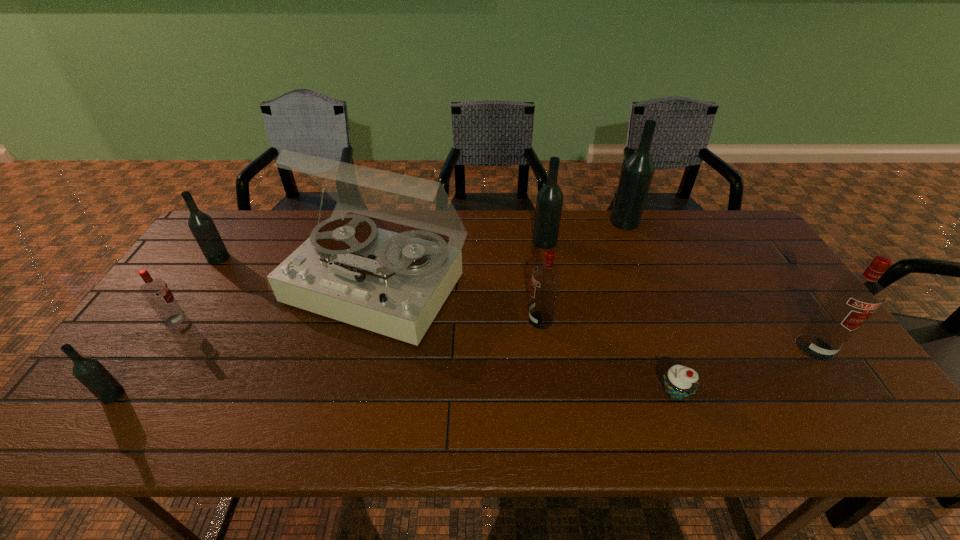
Locate which object is the fourth closest to the second nearest black vodka. Please provide its 2D coordinates. Your answer should be formatted as a tuple, i.e. [(x, y)], where the tuple contains the x and y coordinates of a point satisfying the conditions above.

[(546, 278)]

Locate which object is the sixth closest to the farthest object. Please provide its 2D coordinates. Your answer should be formatted as a tuple, i.e. [(x, y)], where the tuple contains the x and y coordinates of a point satisfying the conditions above.

[(201, 225)]

Select which vodka appears as the fourth closest to the smallest black vodka. Please provide its 2D coordinates. Your answer should be formatted as a tuple, i.e. [(x, y)], where the tuple contains the x and y coordinates of a point satisfying the conditions above.

[(549, 202)]

This screenshot has width=960, height=540. In order to click on vodka that stands as the fifth closest to the third black vodka from left to right in this screenshot , I will do `click(157, 293)`.

Identify which black vodka is the third closest to the leftmost red vodka. Please provide its 2D coordinates. Your answer should be formatted as a tuple, i.e. [(x, y)], where the tuple contains the x and y coordinates of a point satisfying the conditions above.

[(549, 202)]

You are a GUI agent. You are given a task and a screenshot of the screen. Output one action in this format:
    pyautogui.click(x=<x>, y=<y>)
    Task: Click on the black vodka that is the closest to the smallest black vodka
    Image resolution: width=960 pixels, height=540 pixels.
    Given the screenshot: What is the action you would take?
    pyautogui.click(x=201, y=225)

Point out which red vodka is positioned as the second nearest to the second nearest black vodka. Please provide its 2D coordinates. Your answer should be formatted as a tuple, i.e. [(x, y)], where the tuple contains the x and y coordinates of a point satisfying the conditions above.

[(546, 278)]

Where is `red vodka object that ranks as the closest to the second farthest black vodka`? red vodka object that ranks as the closest to the second farthest black vodka is located at coordinates (546, 278).

This screenshot has height=540, width=960. Find the location of `free region that satisfies the following two spatial constraints: 1. on the back side of the sixth vodka from left to right; 2. on the left side of the shortest object`. free region that satisfies the following two spatial constraints: 1. on the back side of the sixth vodka from left to right; 2. on the left side of the shortest object is located at coordinates (612, 222).

Locate an element on the screen. blank area in the image that satisfies the following two spatial constraints: 1. on the back side of the second nearest black vodka; 2. on the left side of the third black vodka from left to right is located at coordinates (229, 241).